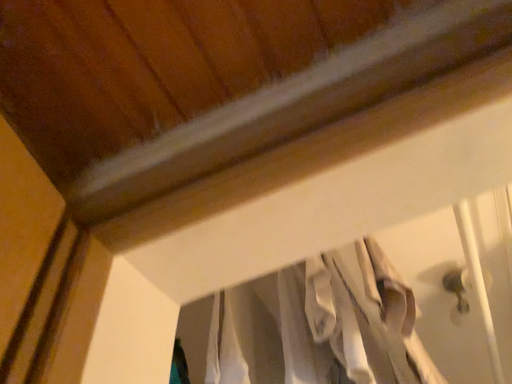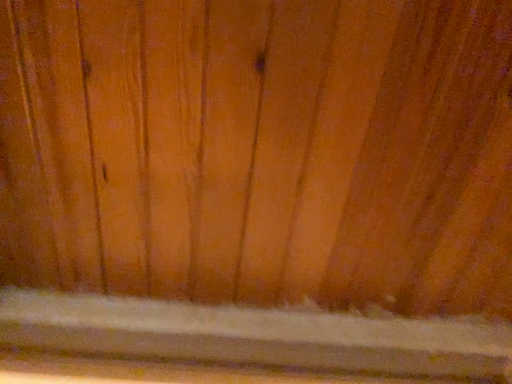
Question: How did the camera likely rotate when shooting the video?

Choices:
 (A) rotated right
 (B) rotated left

Answer: (A)